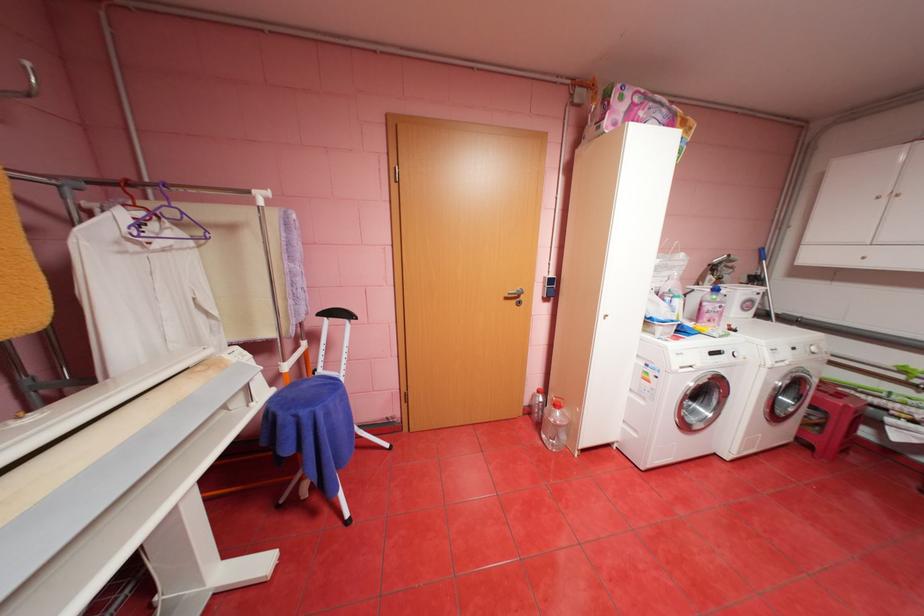
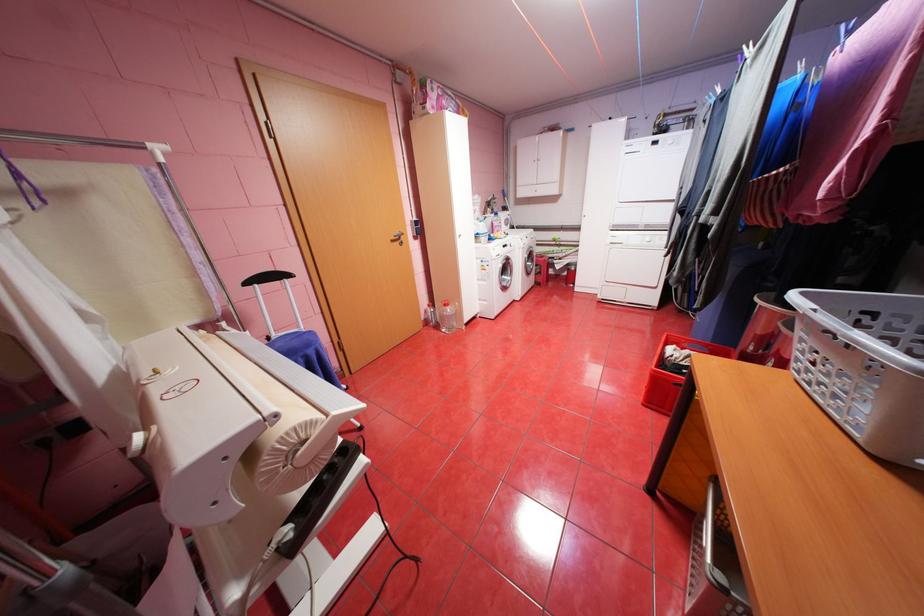
Where in the second image is the point corresponding to point 515,298 from the first image?

(400, 241)